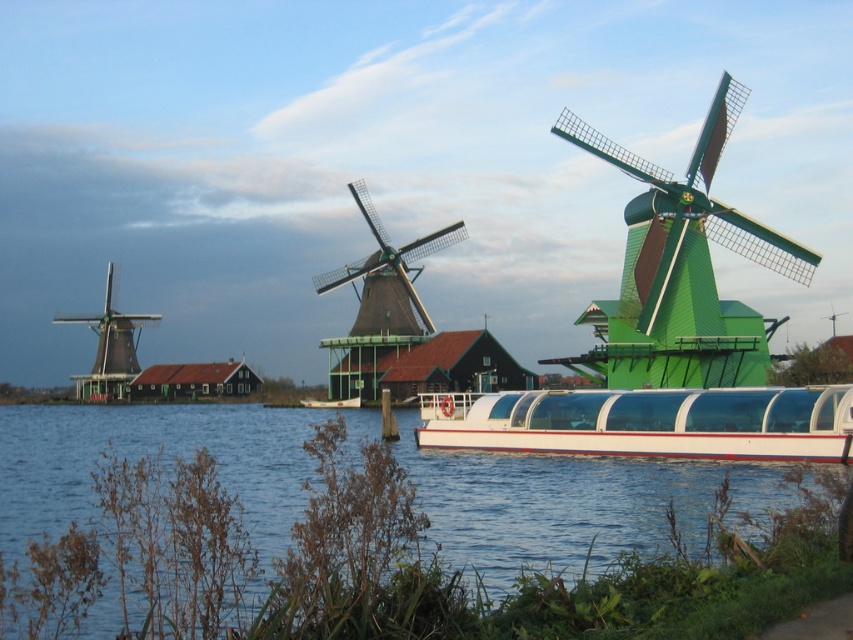
Between point (181, 596) and point (105, 401), which one is positioned in front?

Positioned in front is point (181, 596).

Is blue water at lower center thinner than green wooden windmill at left?

Incorrect, blue water at lower center's width is not less than green wooden windmill at left's.

Identify the location of blue water at lower center. (368, 564).

Does green matte windmill at center have a greater width compared to white glossy boat at center?

Indeed, green matte windmill at center has a greater width compared to white glossy boat at center.

Can you confirm if green matte windmill at center is positioned above white glossy boat at center?

Indeed, green matte windmill at center is positioned over white glossy boat at center.

Is point (718, 209) positioned in front of point (308, 403)?

Yes, point (718, 209) is in front of point (308, 403).

Where is `green matte windmill at center`? green matte windmill at center is located at coordinates (682, 268).

Measure the distance between point (728, 321) and camera.

Point (728, 321) and camera are 93.09 meters apart.

Does point (654, 378) come in front of point (109, 301)?

Yes, point (654, 378) is in front of point (109, 301).

Who is more distant from viewer, (718,147) or (76,380)?

Point (76,380)

Identify the location of green matte windmill at center. This screenshot has height=640, width=853. (682, 268).